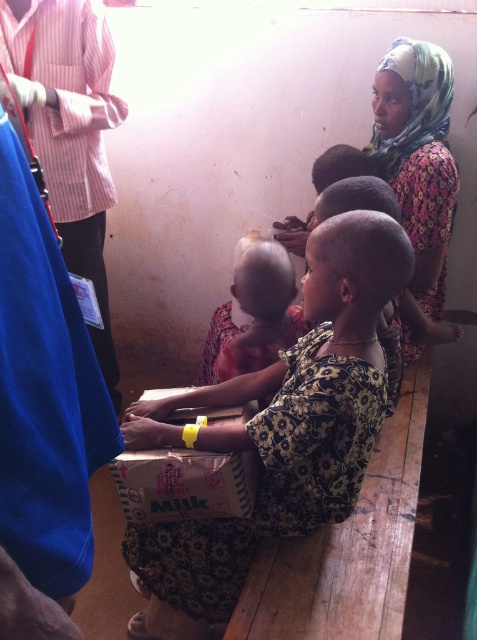
Is wooden bench at lower center to the left of smooth skin baby at center from the viewer's perspective?

Incorrect, wooden bench at lower center is not on the left side of smooth skin baby at center.

Is wooden bench at lower center above smooth skin baby at center?

No.

The image size is (477, 640). What do you see at coordinates (348, 547) in the screenshot?
I see `wooden bench at lower center` at bounding box center [348, 547].

Locate an element on the screen. The image size is (477, 640). wooden bench at lower center is located at coordinates [x=348, y=547].

The width and height of the screenshot is (477, 640). In order to click on floral fabric dress at center in this screenshot , I will do `click(279, 429)`.

Does floral fabric dress at center have a greater height compared to floral fabric headscarf at upper right?

Yes, floral fabric dress at center is taller than floral fabric headscarf at upper right.

The width and height of the screenshot is (477, 640). I want to click on floral fabric dress at center, so click(x=279, y=429).

Consider the image. Which is below, wooden bench at lower center or floral fabric headscarf at upper right?

wooden bench at lower center is lower down.

Is point (366, 497) farther from camera compared to point (434, 321)?

No.

Is point (342, 592) farther from camera compared to point (449, 224)?

No, (342, 592) is closer to viewer.

Identify the location of wooden bench at lower center. (348, 547).